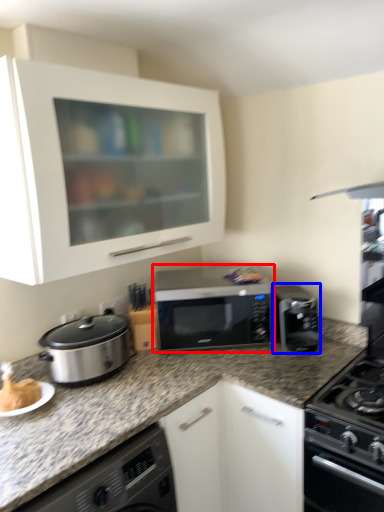
Question: Which object is closer to the camera taking this photo, microwave oven (highlighted by a red box) or kitchen appliance (highlighted by a blue box)?

Choices:
 (A) microwave oven
 (B) kitchen appliance

Answer: (B)